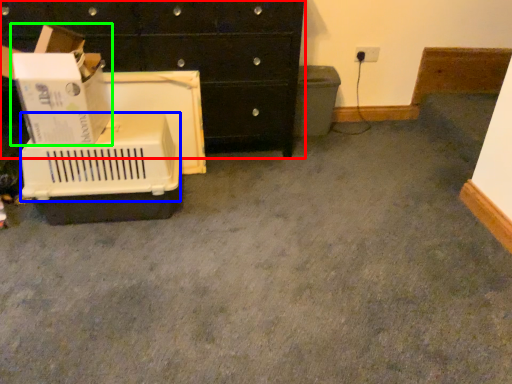
Question: Which object is positioned closest to chest of drawers (highlighted by a red box)? Select from basket (highlighted by a blue box) and cardboard box (highlighted by a green box).

Choices:
 (A) basket
 (B) cardboard box

Answer: (B)